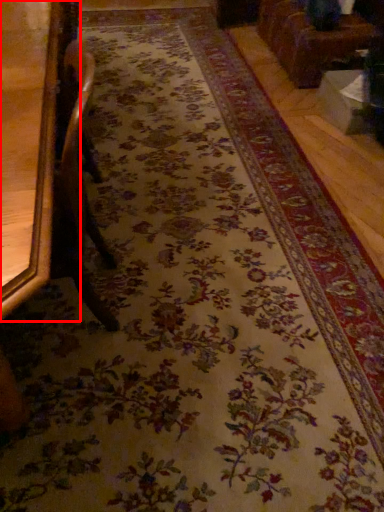
Question: Considering the relative positions of furniture (annotated by the red box) and furniture in the image provided, where is furniture (annotated by the red box) located with respect to the staircase?

Choices:
 (A) right
 (B) left

Answer: (B)